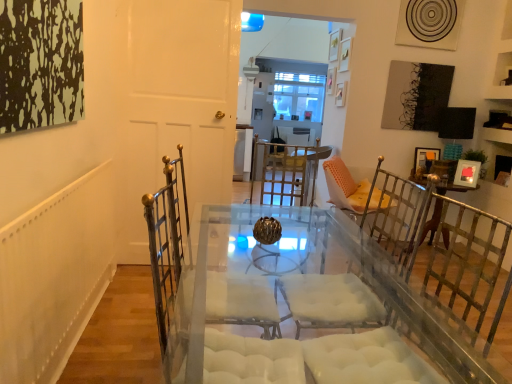
Question: From the image's perspective, is wooden picture frame at right over white matte door at center?

Choices:
 (A) no
 (B) yes

Answer: (A)

Question: Is wooden picture frame at right not inside white matte door at center?

Choices:
 (A) yes
 (B) no

Answer: (A)

Question: Can you confirm if wooden picture frame at right is wider than white matte door at center?

Choices:
 (A) yes
 (B) no

Answer: (B)

Question: From a real-world perspective, is wooden picture frame at right physically above white matte door at center?

Choices:
 (A) yes
 (B) no

Answer: (B)

Question: Could you tell me if wooden picture frame at right is facing white matte door at center?

Choices:
 (A) no
 (B) yes

Answer: (A)

Question: Is wooden picture frame at right oriented away from white matte door at center?

Choices:
 (A) no
 (B) yes

Answer: (A)

Question: Does white matte door at center touch wooden picture frame at right?

Choices:
 (A) no
 (B) yes

Answer: (A)

Question: Can you confirm if white matte door at center is taller than wooden picture frame at right?

Choices:
 (A) no
 (B) yes

Answer: (B)

Question: From the image's perspective, is white matte door at center under wooden picture frame at right?

Choices:
 (A) yes
 (B) no

Answer: (B)

Question: Does white matte door at center appear on the right side of wooden picture frame at right?

Choices:
 (A) no
 (B) yes

Answer: (A)

Question: Is white matte door at center outside of wooden picture frame at right?

Choices:
 (A) yes
 (B) no

Answer: (A)

Question: From a real-world perspective, does white matte door at center stand above wooden picture frame at right?

Choices:
 (A) no
 (B) yes

Answer: (B)

Question: Does point (156, 3) appear closer or farther from the camera than point (417, 177)?

Choices:
 (A) farther
 (B) closer

Answer: (B)